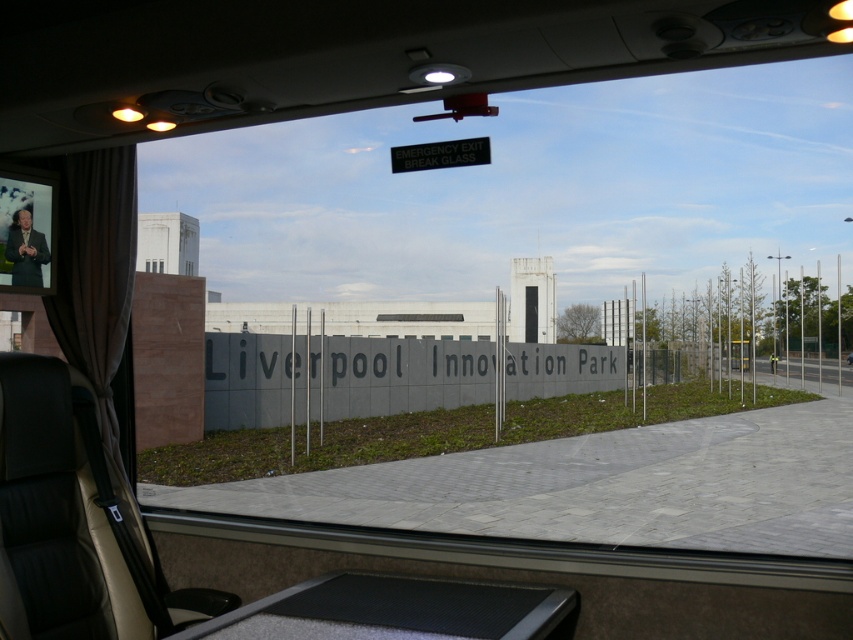
Question: Which object appears closest to the camera in this image?

Choices:
 (A) transparent glass at center
 (B) clear glass window at center

Answer: (B)

Question: Where is clear glass window at center located in relation to transparent glass at center in the image?

Choices:
 (A) left
 (B) right

Answer: (A)

Question: Is clear glass window at center to the right of transparent glass at center from the viewer's perspective?

Choices:
 (A) yes
 (B) no

Answer: (B)

Question: Does clear glass window at center have a smaller size compared to transparent glass at center?

Choices:
 (A) no
 (B) yes

Answer: (A)